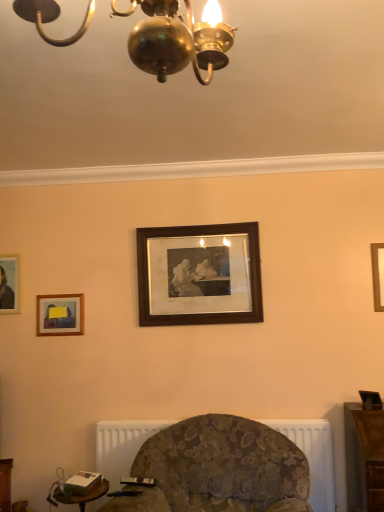
What do you see at coordinates (82, 495) in the screenshot?
I see `white plastic table at lower left` at bounding box center [82, 495].

This screenshot has height=512, width=384. I want to click on white textured radiator at lower center, so click(x=313, y=456).

What is the approximate height of brown wooden picture frame at center, which appears as the 2th picture frame when viewed from the right?

28.35 inches.

How much space does wooden picture frame at right, which appears as the 4th picture frame when viewed from the left, occupy horizontally?

The width of wooden picture frame at right, which appears as the 4th picture frame when viewed from the left, is 1.00 inches.

The image size is (384, 512). Describe the element at coordinates (9, 284) in the screenshot. I see `wooden picture frame at left, which is the first picture frame in left-to-right order` at that location.

This screenshot has height=512, width=384. What are the coordinates of `white plastic table at lower left` in the screenshot? It's located at (82, 495).

Considering the sizes of objects wooden picture frame at right, marked as the first picture frame in a right-to-left arrangement, and brown wooden picture frame at center, which appears as the 2th picture frame when viewed from the right, in the image provided, who is taller, wooden picture frame at right, marked as the first picture frame in a right-to-left arrangement, or brown wooden picture frame at center, which appears as the 2th picture frame when viewed from the right,?

brown wooden picture frame at center, which appears as the 2th picture frame when viewed from the right.

From a real-world perspective, who is located lower, wooden picture frame at right, which appears as the 4th picture frame when viewed from the left, or brown wooden picture frame at center, which appears as the 2th picture frame when viewed from the right?

wooden picture frame at right, which appears as the 4th picture frame when viewed from the left.

What's the angular difference between wooden picture frame at right, marked as the first picture frame in a right-to-left arrangement, and brown wooden picture frame at center, which appears as the 2th picture frame when viewed from the right,'s facing directions?

The facing directions of wooden picture frame at right, marked as the first picture frame in a right-to-left arrangement, and brown wooden picture frame at center, which appears as the 2th picture frame when viewed from the right, are 0.173 degrees apart.

Which object is positioned more to the right, wooden picture frame at left, which is the first picture frame in left-to-right order, or wooden picture frame at right, which appears as the 4th picture frame when viewed from the left?

wooden picture frame at right, which appears as the 4th picture frame when viewed from the left.

From the image's perspective, is wooden picture frame at left, which is counted as the 4th picture frame, starting from the right, located beneath wooden picture frame at right, which appears as the 4th picture frame when viewed from the left?

Yes, from the image's perspective, wooden picture frame at left, which is counted as the 4th picture frame, starting from the right, is beneath wooden picture frame at right, which appears as the 4th picture frame when viewed from the left.

Are wooden picture frame at left, which is counted as the 4th picture frame, starting from the right, and wooden picture frame at right, marked as the first picture frame in a right-to-left arrangement, beside each other?

They are not placed beside each other.

Considering the relative sizes of wooden picture frame at left, which is the first picture frame in left-to-right order, and wooden picture frame at right, marked as the first picture frame in a right-to-left arrangement, in the image provided, is wooden picture frame at left, which is the first picture frame in left-to-right order, taller than wooden picture frame at right, marked as the first picture frame in a right-to-left arrangement,?

No, wooden picture frame at left, which is the first picture frame in left-to-right order, is not taller than wooden picture frame at right, marked as the first picture frame in a right-to-left arrangement.

Is matte gold picture frame at upper left, marked as the 2th picture frame in a left-to-right arrangement, taller or shorter than white plastic table at lower left?

matte gold picture frame at upper left, marked as the 2th picture frame in a left-to-right arrangement, is taller than white plastic table at lower left.

Is white plastic table at lower left a part of matte gold picture frame at upper left, the 3th picture frame positioned from the right?

No, white plastic table at lower left is not surrounded by matte gold picture frame at upper left, the 3th picture frame positioned from the right.

From the picture: Is matte gold picture frame at upper left, the 3th picture frame positioned from the right, positioned behind white plastic table at lower left?

Yes, matte gold picture frame at upper left, the 3th picture frame positioned from the right, is further from the camera.

Is the depth of white textured radiator at lower center less than that of white plastic table at lower left?

No, white textured radiator at lower center is behind white plastic table at lower left.

Find the location of a particular element. The width and height of the screenshot is (384, 512). table below the white textured radiator at lower center (from the image's perspective) is located at coordinates (82, 495).

Is white textured radiator at lower center oriented away from white plastic table at lower left?

white textured radiator at lower center does not have its back to white plastic table at lower left.

From a real-world perspective, count 2nd picture frames upward from the white plastic table at lower left and point to it. Please provide its 2D coordinates.

[(378, 275)]

How many degrees apart are the facing directions of white plastic table at lower left and wooden picture frame at right, which appears as the 4th picture frame when viewed from the left?

The angular difference between white plastic table at lower left and wooden picture frame at right, which appears as the 4th picture frame when viewed from the left, is 0.757 degrees.

Which object is positioned more to the right, white plastic table at lower left or wooden picture frame at right, which appears as the 4th picture frame when viewed from the left?

From the viewer's perspective, wooden picture frame at right, which appears as the 4th picture frame when viewed from the left, appears more on the right side.

From a real-world perspective, who is located higher, brown wooden picture frame at center, which appears as the 2th picture frame when viewed from the right, or wooden picture frame at left, which is the first picture frame in left-to-right order?

From a 3D spatial view, brown wooden picture frame at center, which appears as the 2th picture frame when viewed from the right, is above.

Does brown wooden picture frame at center, which is counted as the 3th picture frame, starting from the left, appear on the left side of wooden picture frame at left, which is the first picture frame in left-to-right order?

No, brown wooden picture frame at center, which is counted as the 3th picture frame, starting from the left, is not to the left of wooden picture frame at left, which is the first picture frame in left-to-right order.

Which of these two, brown wooden picture frame at center, which is counted as the 3th picture frame, starting from the left, or wooden picture frame at left, which is the first picture frame in left-to-right order, stands shorter?

Standing shorter between the two is wooden picture frame at left, which is the first picture frame in left-to-right order.

Is brown wooden picture frame at center, which appears as the 2th picture frame when viewed from the right, placed right next to wooden picture frame at left, which is the first picture frame in left-to-right order?

brown wooden picture frame at center, which appears as the 2th picture frame when viewed from the right, and wooden picture frame at left, which is the first picture frame in left-to-right order, are not in contact.

Can matte gold picture frame at upper left, the 3th picture frame positioned from the right, be found inside white textured radiator at lower center?

Actually, matte gold picture frame at upper left, the 3th picture frame positioned from the right, is outside white textured radiator at lower center.

Is white textured radiator at lower center positioned with its back to matte gold picture frame at upper left, marked as the 2th picture frame in a left-to-right arrangement?

No.

Does white textured radiator at lower center have a lesser height compared to matte gold picture frame at upper left, the 3th picture frame positioned from the right?

No, white textured radiator at lower center is not shorter than matte gold picture frame at upper left, the 3th picture frame positioned from the right.

Considering their positions, is white textured radiator at lower center located in front of or behind matte gold picture frame at upper left, the 3th picture frame positioned from the right?

In the image, white textured radiator at lower center appears in front of matte gold picture frame at upper left, the 3th picture frame positioned from the right.

Identify the location of the 2nd picture frame located beneath the brown wooden picture frame at center, which appears as the 2th picture frame when viewed from the right (from a real-world perspective). The image size is (384, 512). click(378, 275).

Starting from the wooden picture frame at right, which appears as the 4th picture frame when viewed from the left, which picture frame is the 3rd one behind? Please provide its 2D coordinates.

[(9, 284)]

Which object lies further to the anchor point brown wooden picture frame at center, which is counted as the 3th picture frame, starting from the left, wooden picture frame at right, marked as the first picture frame in a right-to-left arrangement, or matte gold picture frame at upper left, the 3th picture frame positioned from the right?

wooden picture frame at right, marked as the first picture frame in a right-to-left arrangement, lies further to brown wooden picture frame at center, which is counted as the 3th picture frame, starting from the left, than the other object.

Considering their positions, is brown wooden picture frame at center, which appears as the 2th picture frame when viewed from the right, positioned closer to matte gold picture frame at upper left, marked as the 2th picture frame in a left-to-right arrangement, than white textured radiator at lower center?

brown wooden picture frame at center, which appears as the 2th picture frame when viewed from the right, is closer to matte gold picture frame at upper left, marked as the 2th picture frame in a left-to-right arrangement.

From the image, which object appears to be nearer to white textured radiator at lower center, brown wooden picture frame at center, which appears as the 2th picture frame when viewed from the right, or wooden picture frame at right, marked as the first picture frame in a right-to-left arrangement?

wooden picture frame at right, marked as the first picture frame in a right-to-left arrangement, is positioned closer to the anchor white textured radiator at lower center.

From the image, which object appears to be nearer to white textured radiator at lower center, matte gold picture frame at upper left, marked as the 2th picture frame in a left-to-right arrangement, or wooden picture frame at right, which appears as the 4th picture frame when viewed from the left?

Based on the image, wooden picture frame at right, which appears as the 4th picture frame when viewed from the left, appears to be nearer to white textured radiator at lower center.

Estimate the real-world distances between objects in this image. Which object is further from white textured radiator at lower center, wooden picture frame at right, marked as the first picture frame in a right-to-left arrangement, or brown wooden picture frame at center, which appears as the 2th picture frame when viewed from the right?

brown wooden picture frame at center, which appears as the 2th picture frame when viewed from the right, is further to white textured radiator at lower center.

Considering their positions, is white textured radiator at lower center positioned closer to wooden picture frame at left, which is the first picture frame in left-to-right order, than matte gold picture frame at upper left, marked as the 2th picture frame in a left-to-right arrangement?

matte gold picture frame at upper left, marked as the 2th picture frame in a left-to-right arrangement, is positioned closer to the anchor wooden picture frame at left, which is the first picture frame in left-to-right order.

Which object lies nearer to the anchor point white plastic table at lower left, matte gold picture frame at upper left, the 3th picture frame positioned from the right, or brown wooden picture frame at center, which is counted as the 3th picture frame, starting from the left?

matte gold picture frame at upper left, the 3th picture frame positioned from the right, lies closer to white plastic table at lower left than the other object.

Estimate the real-world distances between objects in this image. Which object is further from wooden picture frame at left, which is counted as the 4th picture frame, starting from the right, white plastic table at lower left or white textured radiator at lower center?

white textured radiator at lower center is positioned further to the anchor wooden picture frame at left, which is counted as the 4th picture frame, starting from the right.

The width and height of the screenshot is (384, 512). Find the location of `radiator between matte gold picture frame at upper left, marked as the 2th picture frame in a left-to-right arrangement, and white plastic table at lower left, in the vertical direction`. radiator between matte gold picture frame at upper left, marked as the 2th picture frame in a left-to-right arrangement, and white plastic table at lower left, in the vertical direction is located at coordinates (313, 456).

Where is `radiator between wooden picture frame at left, which is the first picture frame in left-to-right order, and wooden picture frame at right, marked as the first picture frame in a right-to-left arrangement, in the horizontal direction`? The width and height of the screenshot is (384, 512). radiator between wooden picture frame at left, which is the first picture frame in left-to-right order, and wooden picture frame at right, marked as the first picture frame in a right-to-left arrangement, in the horizontal direction is located at coordinates (313, 456).

Locate an element on the screen. The width and height of the screenshot is (384, 512). picture frame between matte gold picture frame at upper left, the 3th picture frame positioned from the right, and wooden picture frame at right, which appears as the 4th picture frame when viewed from the left, from left to right is located at coordinates (199, 274).

What are the coordinates of `radiator between brown wooden picture frame at center, which appears as the 2th picture frame when viewed from the right, and wooden picture frame at right, which appears as the 4th picture frame when viewed from the left` in the screenshot? It's located at (313, 456).